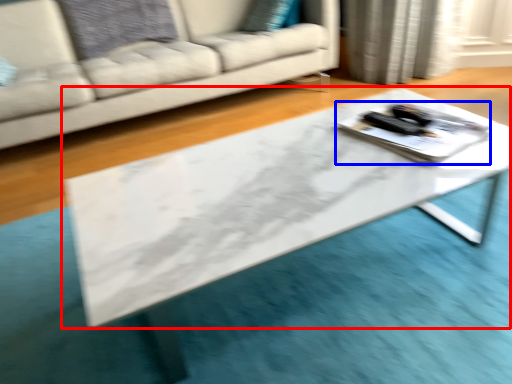
Question: Which of the following is the farthest to the observer, table (highlighted by a red box) or tray (highlighted by a blue box)?

Choices:
 (A) table
 (B) tray

Answer: (B)